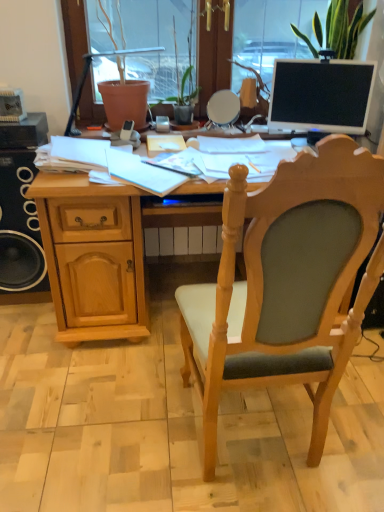
Question: Should I look upward or downward to see light wood/wooden chair at center?

Choices:
 (A) down
 (B) up

Answer: (A)

Question: Is matte black monitor at upper right surrounding black matte speaker at left?

Choices:
 (A) yes
 (B) no

Answer: (B)

Question: Does matte black monitor at upper right have a larger size compared to black matte speaker at left?

Choices:
 (A) no
 (B) yes

Answer: (A)

Question: Does matte black monitor at upper right have a greater width compared to black matte speaker at left?

Choices:
 (A) no
 (B) yes

Answer: (A)

Question: Can you confirm if matte black monitor at upper right is taller than black matte speaker at left?

Choices:
 (A) yes
 (B) no

Answer: (B)

Question: Considering the relative sizes of matte black monitor at upper right and black matte speaker at left in the image provided, is matte black monitor at upper right smaller than black matte speaker at left?

Choices:
 (A) no
 (B) yes

Answer: (B)

Question: Is matte black monitor at upper right touching black matte speaker at left?

Choices:
 (A) no
 (B) yes

Answer: (A)

Question: From a real-world perspective, is black matte speaker at left on light wood/wooden chair at center?

Choices:
 (A) no
 (B) yes

Answer: (A)

Question: Is black matte speaker at left wider than light wood/wooden chair at center?

Choices:
 (A) no
 (B) yes

Answer: (A)

Question: From the image's perspective, would you say black matte speaker at left is positioned over light wood/wooden chair at center?

Choices:
 (A) yes
 (B) no

Answer: (A)

Question: Is black matte speaker at left positioned far away from light wood/wooden chair at center?

Choices:
 (A) no
 (B) yes

Answer: (B)

Question: Can you confirm if black matte speaker at left is thinner than light wood/wooden chair at center?

Choices:
 (A) no
 (B) yes

Answer: (B)

Question: Can you confirm if black matte speaker at left is bigger than light wood/wooden chair at center?

Choices:
 (A) no
 (B) yes

Answer: (A)

Question: Is black matte speaker at left thinner than light wood desk at center?

Choices:
 (A) no
 (B) yes

Answer: (B)